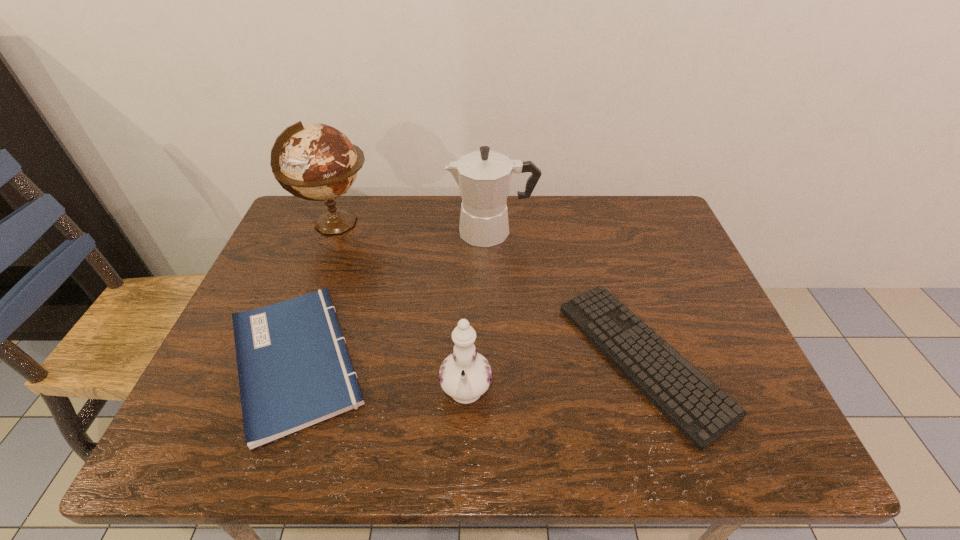
Identify the location of vacant space located 0.050m at the spout of the third tallest object. The image size is (960, 540). (465, 451).

At what (x,y) coordinates should I click in order to perform the action: click on vacant region located on the right of the paperback book. Please return your answer as a coordinate pair (x, y). Image resolution: width=960 pixels, height=540 pixels. Looking at the image, I should click on [423, 361].

You are a GUI agent. You are given a task and a screenshot of the screen. Output one action in this format:
    pyautogui.click(x=<x>, y=<y>)
    Task: Click on the free spot located on the back of the rightmost object
    
    Given the screenshot: What is the action you would take?
    pyautogui.click(x=602, y=233)

Identify the location of globe that is at the far edge. The image size is (960, 540). (318, 162).

Locate an element on the screen. coffeepot that is positioned at the far edge is located at coordinates (483, 177).

The image size is (960, 540). Identify the location of chinaware situated at the near edge. (465, 375).

You are a GUI agent. You are given a task and a screenshot of the screen. Output one action in this format:
    pyautogui.click(x=<x>, y=<y>)
    Task: Click on the paperback book located in the near edge section of the desktop
    
    Given the screenshot: What is the action you would take?
    pyautogui.click(x=294, y=370)

Locate an element on the screen. computer keyboard that is at the near edge is located at coordinates (702, 412).

Identify the location of globe that is at the left edge. (318, 162).

At what (x,y) coordinates should I click in order to perform the action: click on paperback book at the left edge. Please return your answer as a coordinate pair (x, y). Image resolution: width=960 pixels, height=540 pixels. Looking at the image, I should click on (294, 370).